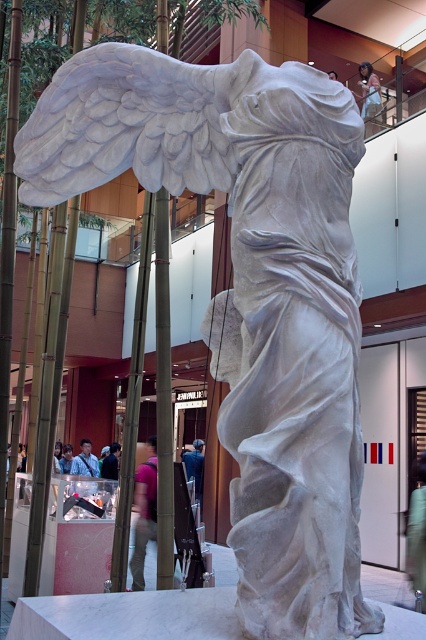
You are an art conservator standing in front of the Winged Victory of Samothrace sculpture. You need to move the pink fabric pants at center and the light brown wooden chair at upper center to a storage room. Which object should you move first to ensure you can access the storage room located behind the statue?

You should move the pink fabric pants at center first because it is closer to the viewer than the light brown wooden chair at upper center, so moving it first will allow you to access the storage room behind the statue more easily.

You are standing in front of the Winged Victory of Samothrace sculpture and want to take a photo of the point at coordinates point (141, 492). If your camera can focus on objects up to 30 feet away, will it be able to capture the point clearly?

The distance of point (141, 492) from the camera is 31.25 feet, which is beyond the camera focus limit of 30 feet. Therefore, the camera will not be able to capture the point clearly.

You are an interior designer assessing the space in the image. You need to determine if the pink fabric pants at center can be placed on top of the light brown wooden chair at upper center. Based on their heights, is this feasible?

The pink fabric pants at center has a lesser height compared to the light brown wooden chair at upper center, so placing the pink fabric pants at center on top of the light brown wooden chair at upper center would be feasible as it is shorter and less likely to obstruct the chair.